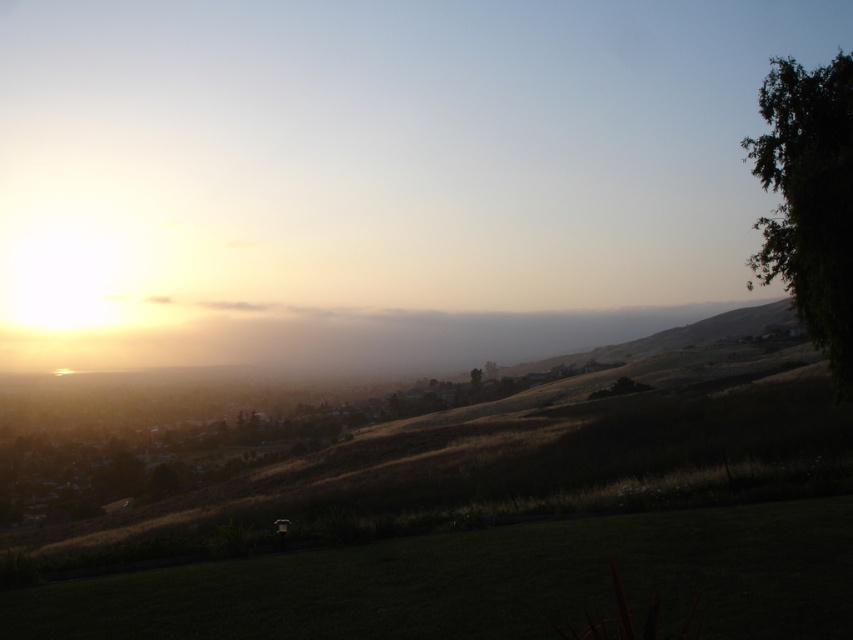
Question: Does green grassy at lower center come behind green leafy tree at right?

Choices:
 (A) no
 (B) yes

Answer: (A)

Question: Which point is farther from the camera taking this photo?

Choices:
 (A) [x=819, y=86]
 (B) [x=369, y=589]

Answer: (A)

Question: Is green grassy at lower center further to the viewer compared to green leafy tree at right?

Choices:
 (A) yes
 (B) no

Answer: (B)

Question: Which of the following is the closest to the observer?

Choices:
 (A) (807, 81)
 (B) (505, 536)

Answer: (B)

Question: Does green grassy at lower center appear on the right side of green leafy tree at right?

Choices:
 (A) yes
 (B) no

Answer: (B)